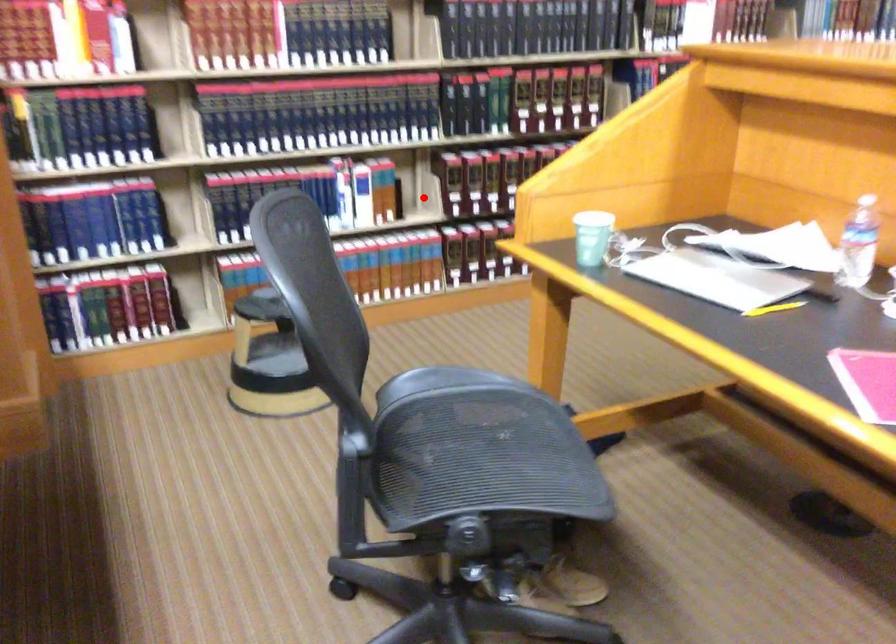
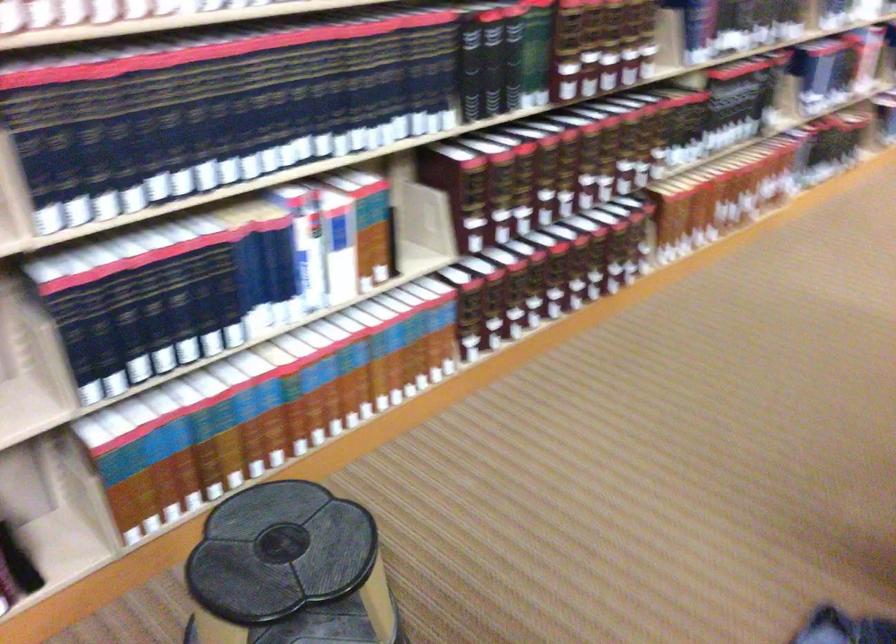
Find the pixel in the second image that matches the highlighted location in the first image.

(421, 228)